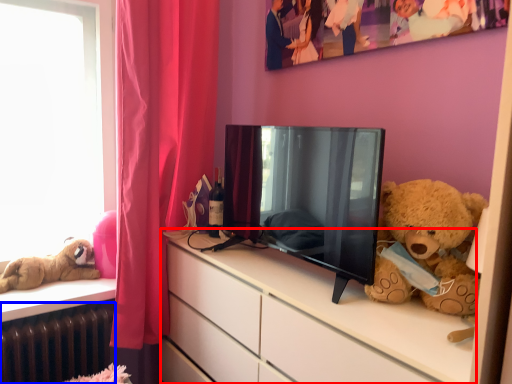
Question: Which object is closer to the camera taking this photo, cabinetry (highlighted by a red box) or radiator (highlighted by a blue box)?

Choices:
 (A) cabinetry
 (B) radiator

Answer: (A)